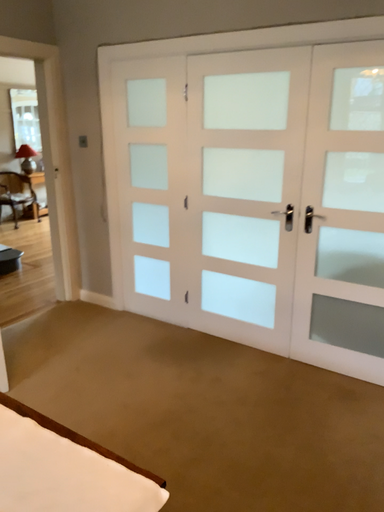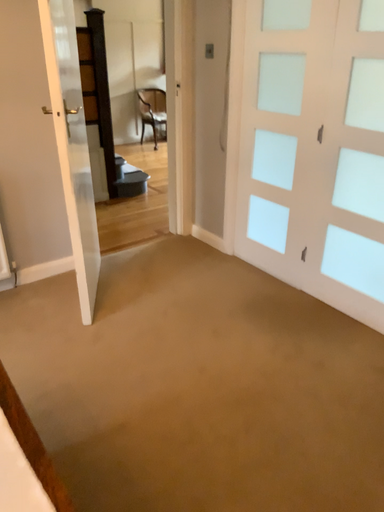
Question: How did the camera likely rotate when shooting the video?

Choices:
 (A) rotated left
 (B) rotated right

Answer: (A)